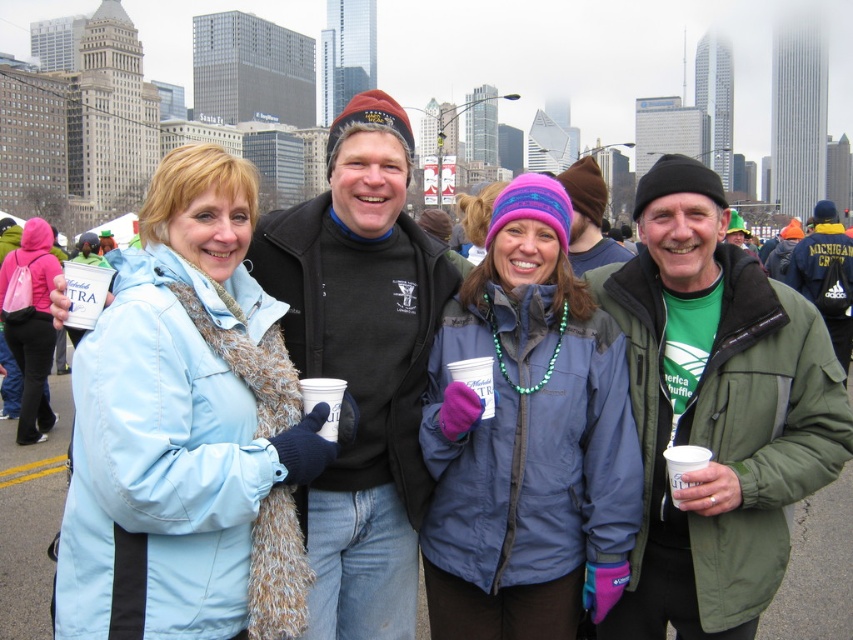
You are a photographer at the event and want to capture a photo that includes both the green fabric jacket at right and the white paper cup at center right. Based on their positions, which object should you focus on first to ensure both are in frame?

The green fabric jacket at right is above the white paper cup at center right, so you should focus on the green fabric jacket at right first to ensure both are in frame.

Looking at this image, you are an observer looking at the image. You notice the blue nylon jacket at center and the pink fabric backpack at left. Which object is positioned lower in the image?

The blue nylon jacket at center is positioned below the pink fabric backpack at left, so it is lower in the image.